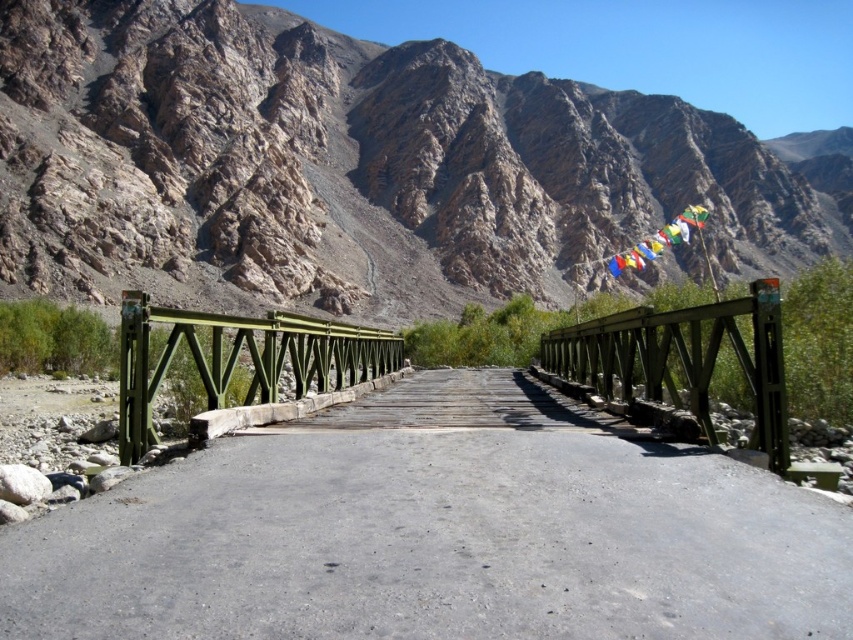
Question: Which point is farther to the camera?

Choices:
 (A) smooth concrete bridge at center
 (B) green metallic bridge at center
 (C) green wooden bridge at upper center

Answer: (B)

Question: Which point is closer to the camera?

Choices:
 (A) (459, 179)
 (B) (161, 317)

Answer: (B)

Question: Does smooth concrete bridge at center appear over green wooden bridge at upper center?

Choices:
 (A) yes
 (B) no

Answer: (B)

Question: Is green wooden bridge at upper center bigger than green metallic bridge at center?

Choices:
 (A) yes
 (B) no

Answer: (B)

Question: Among these points, which one is nearest to the camera?

Choices:
 (A) (669, 372)
 (B) (670, 449)
 (C) (254, 179)

Answer: (B)

Question: Where is smooth concrete bridge at center located in relation to green wooden bridge at upper center in the image?

Choices:
 (A) right
 (B) left

Answer: (B)